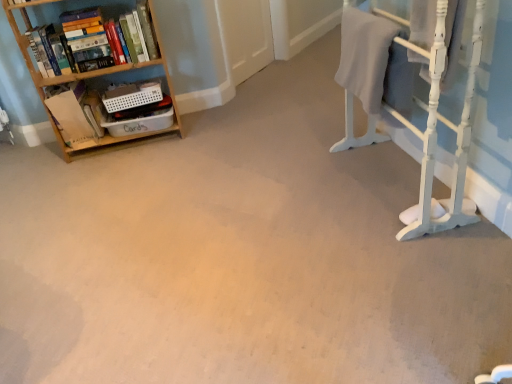
Question: Visually, is hardcover books at left positioned to the left or to the right of wooden bookshelf at left?

Choices:
 (A) right
 (B) left

Answer: (A)

Question: Choose the correct answer: Is hardcover books at left inside wooden bookshelf at left or outside it?

Choices:
 (A) inside
 (B) outside

Answer: (A)

Question: Which is nearer to the gray cotton bath towel at upper right?

Choices:
 (A) hardcover books at left
 (B) white painted wood bunk bed at right
 (C) wooden bookshelf at left

Answer: (B)

Question: Estimate the real-world distances between objects in this image. Which object is farther from the gray cotton bath towel at upper right?

Choices:
 (A) wooden bookshelf at left
 (B) hardcover books at left
 (C) white painted wood bunk bed at right

Answer: (A)